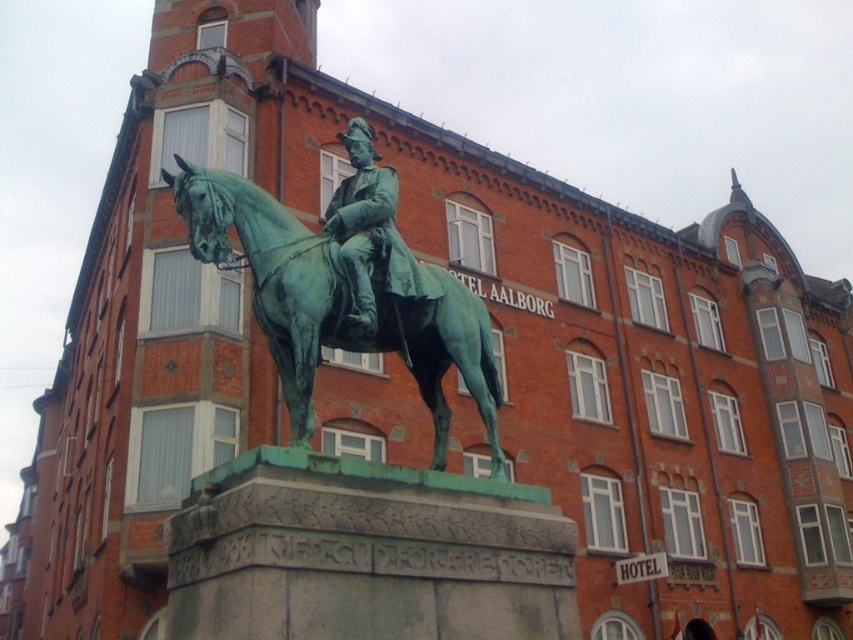
Question: From the image, what is the correct spatial relationship of green patina horse at center in relation to green patina bronze statue at center?

Choices:
 (A) left
 (B) right

Answer: (B)

Question: Among these objects, which one is nearest to the camera?

Choices:
 (A) green patina bronze statue at center
 (B) green patina horse at center

Answer: (B)

Question: Is green patina horse at center bigger than green patina bronze statue at center?

Choices:
 (A) no
 (B) yes

Answer: (A)

Question: Can you confirm if green patina horse at center is smaller than green patina bronze statue at center?

Choices:
 (A) yes
 (B) no

Answer: (A)